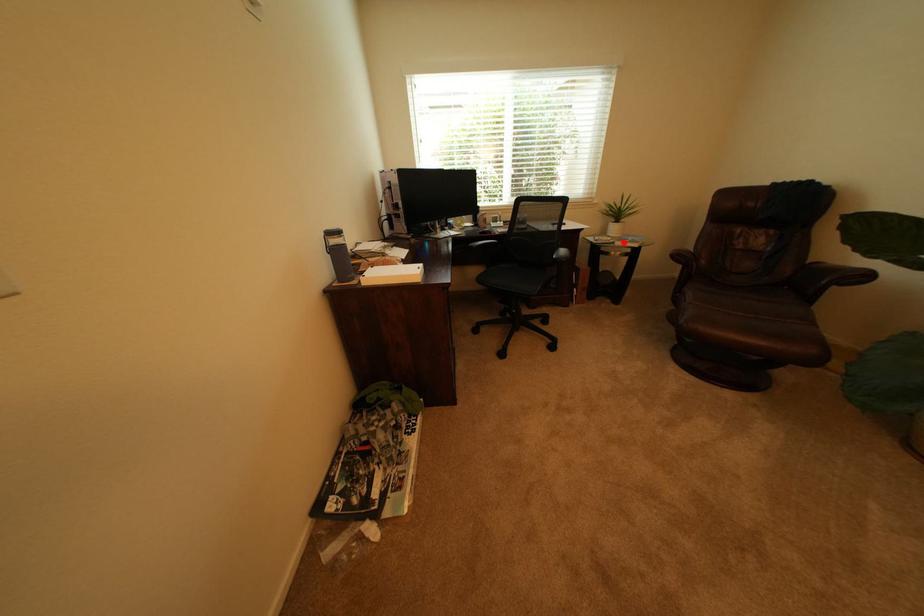
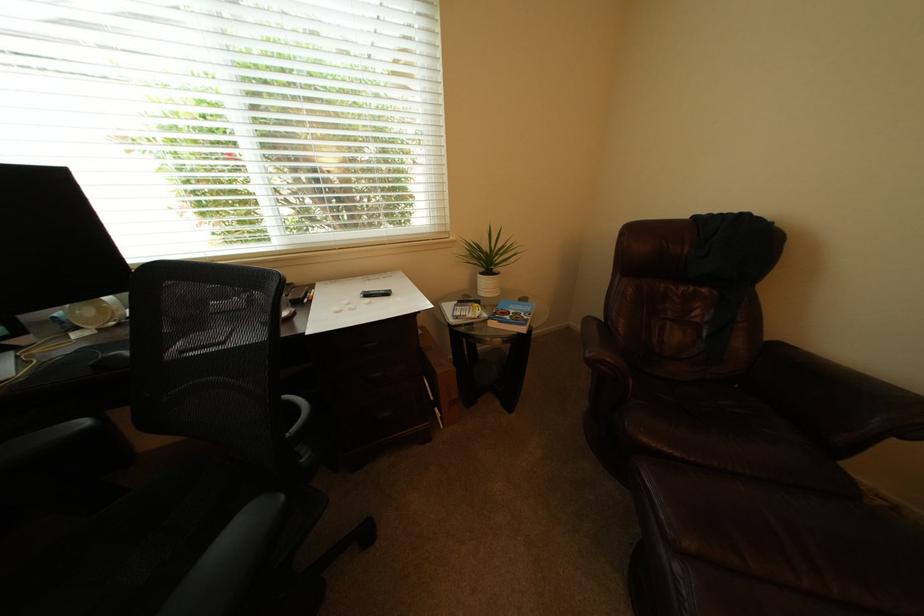
Question: I am providing you with two images of the same scene from different viewpoints. Image1 has a red point marked. In image2, the corresponding 3D location appears at what relative position? Reply with the corresponding letter.

Choices:
 (A) Closer
 (B) Farther

Answer: (B)